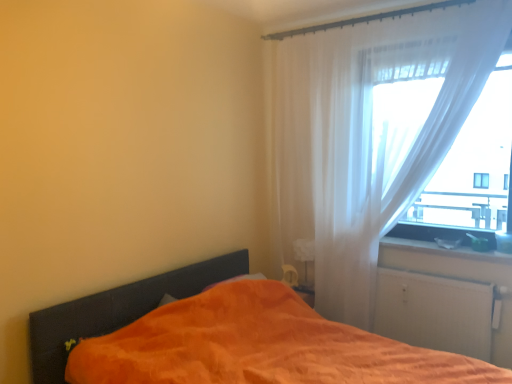
Question: From the image's perspective, is white glossy window sill at lower right over orange soft fabric bed at lower left?

Choices:
 (A) no
 (B) yes

Answer: (B)

Question: Is white glossy window sill at lower right shorter than orange soft fabric bed at lower left?

Choices:
 (A) no
 (B) yes

Answer: (B)

Question: Is white glossy window sill at lower right facing away from orange soft fabric bed at lower left?

Choices:
 (A) no
 (B) yes

Answer: (A)

Question: Can you confirm if white glossy window sill at lower right is positioned to the right of orange soft fabric bed at lower left?

Choices:
 (A) yes
 (B) no

Answer: (A)

Question: From a real-world perspective, is white glossy window sill at lower right located higher than orange soft fabric bed at lower left?

Choices:
 (A) no
 (B) yes

Answer: (B)

Question: Is orange soft fabric bed at lower left spatially inside white matte radiator at lower right, or outside of it?

Choices:
 (A) outside
 (B) inside

Answer: (A)

Question: In terms of height, does orange soft fabric bed at lower left look taller or shorter compared to white matte radiator at lower right?

Choices:
 (A) short
 (B) tall

Answer: (B)

Question: From a real-world perspective, is orange soft fabric bed at lower left physically located above or below white matte radiator at lower right?

Choices:
 (A) above
 (B) below

Answer: (B)

Question: In terms of size, does orange soft fabric bed at lower left appear bigger or smaller than white matte radiator at lower right?

Choices:
 (A) small
 (B) big

Answer: (B)

Question: Is white matte radiator at lower right situated inside orange soft fabric bed at lower left or outside?

Choices:
 (A) outside
 (B) inside

Answer: (A)

Question: Is white matte radiator at lower right bigger or smaller than orange soft fabric bed at lower left?

Choices:
 (A) small
 (B) big

Answer: (A)

Question: Is white matte radiator at lower right to the left or to the right of orange soft fabric bed at lower left in the image?

Choices:
 (A) left
 (B) right

Answer: (B)

Question: From a real-world perspective, is white matte radiator at lower right physically located above or below orange soft fabric bed at lower left?

Choices:
 (A) below
 (B) above

Answer: (B)

Question: Considering the positions of sheer white curtain at right and white glossy window sill at lower right in the image, is sheer white curtain at right taller or shorter than white glossy window sill at lower right?

Choices:
 (A) short
 (B) tall

Answer: (B)

Question: Visually, is sheer white curtain at right positioned to the left or to the right of white glossy window sill at lower right?

Choices:
 (A) right
 (B) left

Answer: (B)